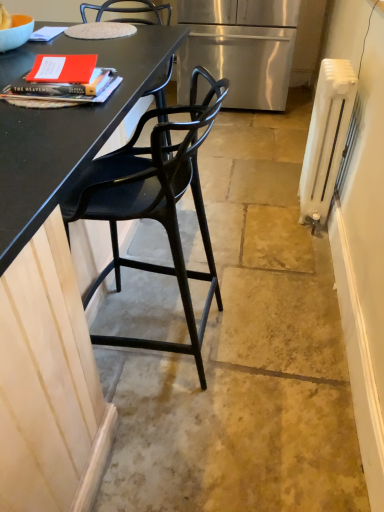
The height and width of the screenshot is (512, 384). Identify the location of empty space that is in between white painted metal radiator at right and black matte chair at left. (245, 265).